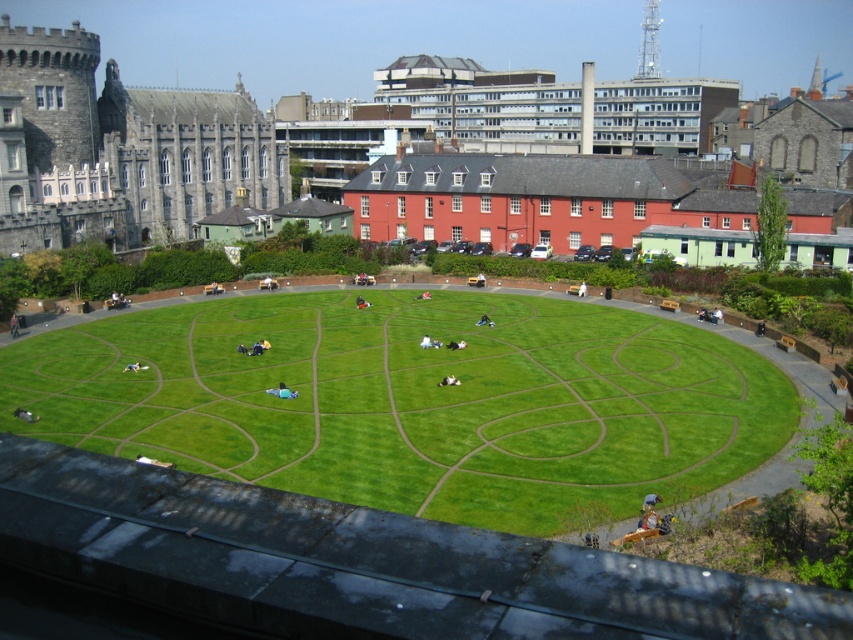
Question: Which point is closer to the camera?

Choices:
 (A) pos(584,291)
 (B) pos(647,518)
 (C) pos(445,378)

Answer: (B)

Question: Is blue denim jacket at lower right further to camera compared to white cotton shirt at center?

Choices:
 (A) no
 (B) yes

Answer: (A)

Question: Can you confirm if green grass at center is positioned above blue denim jacket at lower right?

Choices:
 (A) yes
 (B) no

Answer: (A)

Question: Can you confirm if green grass at center is positioned to the right of light blue fabric at center?

Choices:
 (A) yes
 (B) no

Answer: (B)

Question: Which point appears farthest from the camera in this image?

Choices:
 (A) (642, 518)
 (B) (494, 332)

Answer: (B)

Question: Among these points, which one is farthest from the camera?

Choices:
 (A) (184, 401)
 (B) (645, 499)

Answer: (A)